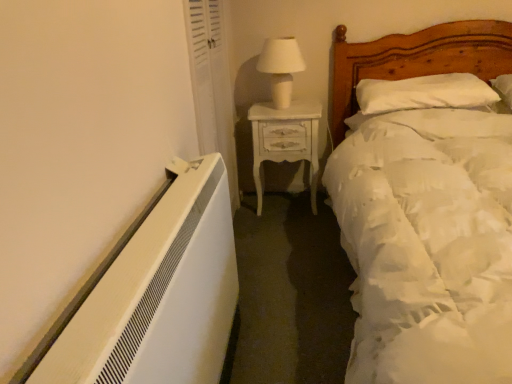
Question: From a real-world perspective, is white soft bed at right positioned above or below white glossy nightstand at center?

Choices:
 (A) above
 (B) below

Answer: (A)

Question: Considering the positions of white soft bed at right and white glossy nightstand at center in the image, is white soft bed at right bigger or smaller than white glossy nightstand at center?

Choices:
 (A) big
 (B) small

Answer: (A)

Question: Considering the real-world distances, which object is closest to the white soft bed at right?

Choices:
 (A) white glossy nightstand at center
 (B) white fabric curtain at upper left
 (C) white soft pillow at upper right
 (D) white ceramic table lamp at upper center

Answer: (C)

Question: Which object is the closest to the white fabric curtain at upper left?

Choices:
 (A) white ceramic table lamp at upper center
 (B) white soft bed at right
 (C) white glossy nightstand at center
 (D) white soft pillow at upper right

Answer: (C)